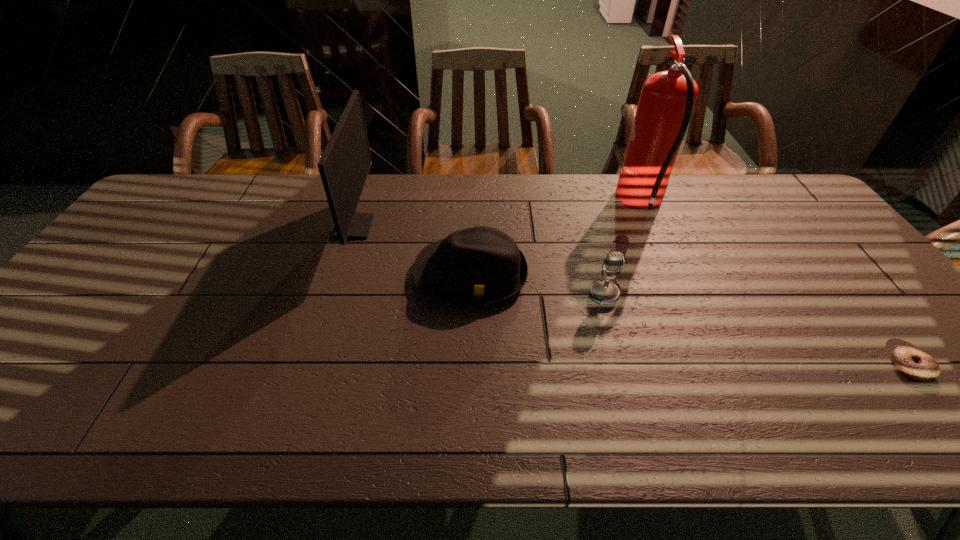
Find the location of a particular element. The height and width of the screenshot is (540, 960). vacant space located towards the nozzle of the fourth object from left to right is located at coordinates (497, 203).

Find the location of a particular element. This screenshot has width=960, height=540. vacant region located 0.250m towards the nozzle of the fourth object from left to right is located at coordinates (542, 203).

Where is `vacant area located 0.370m on the front-facing side of the second tallest object`? vacant area located 0.370m on the front-facing side of the second tallest object is located at coordinates (491, 227).

Find the location of a particular element. free space located 0.290m on the front-facing side of the microphone is located at coordinates (635, 411).

Where is `vacant space located on the front-facing side of the second shortest object`? The height and width of the screenshot is (540, 960). vacant space located on the front-facing side of the second shortest object is located at coordinates (469, 337).

The image size is (960, 540). What are the coordinates of `vacant region located 0.120m on the left of the rightmost object` in the screenshot? It's located at (839, 367).

Where is `fire extinguisher present at the far edge`? fire extinguisher present at the far edge is located at coordinates (667, 99).

Identify the location of computer monitor at the far edge. The image size is (960, 540). (344, 165).

Where is `object present at the right edge`? object present at the right edge is located at coordinates 918,365.

In the image, there is a desktop. Where is `vacant region at the far edge`? The width and height of the screenshot is (960, 540). vacant region at the far edge is located at coordinates (743, 188).